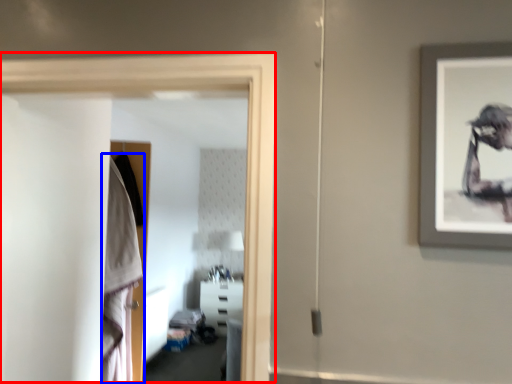
Question: Which of the following is the farthest to the observer, glass door (highlighted by a red box) or robe (highlighted by a blue box)?

Choices:
 (A) glass door
 (B) robe

Answer: (B)